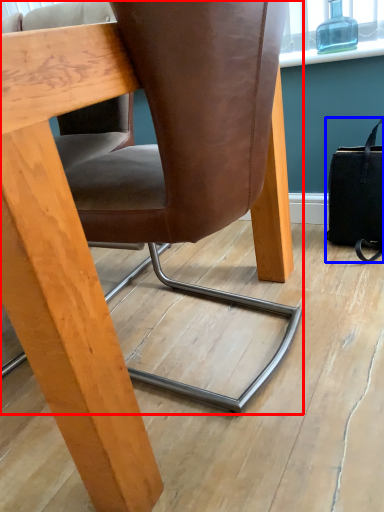
Question: Among these objects, which one is farthest to the camera, chair (highlighted by a red box) or handbag (highlighted by a blue box)?

Choices:
 (A) chair
 (B) handbag

Answer: (B)